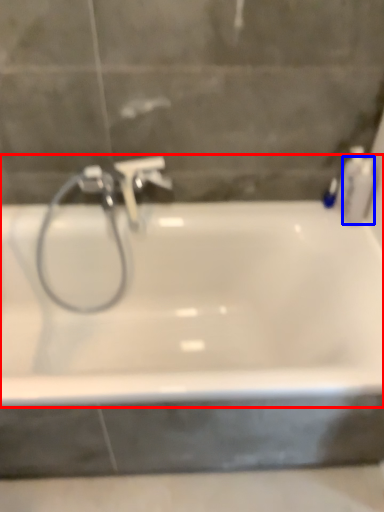
Question: Which point is further to the camera, bathtub (highlighted by a red box) or toiletry (highlighted by a blue box)?

Choices:
 (A) bathtub
 (B) toiletry

Answer: (B)